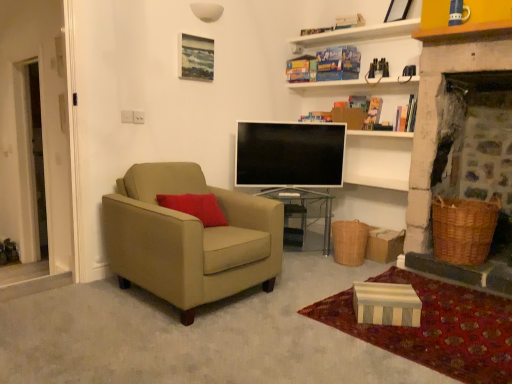
Question: Considering the relative sizes of suede beige armchair at left and striped cardboard box at lower right in the image provided, is suede beige armchair at left shorter than striped cardboard box at lower right?

Choices:
 (A) no
 (B) yes

Answer: (A)

Question: Is suede beige armchair at left oriented towards striped cardboard box at lower right?

Choices:
 (A) yes
 (B) no

Answer: (B)

Question: From a real-world perspective, is suede beige armchair at left beneath striped cardboard box at lower right?

Choices:
 (A) no
 (B) yes

Answer: (A)

Question: Is suede beige armchair at left oriented away from striped cardboard box at lower right?

Choices:
 (A) yes
 (B) no

Answer: (B)

Question: Is suede beige armchair at left not inside striped cardboard box at lower right?

Choices:
 (A) no
 (B) yes

Answer: (B)

Question: Does point (453, 216) appear closer or farther from the camera than point (459, 375)?

Choices:
 (A) farther
 (B) closer

Answer: (A)

Question: Considering the positions of woven brown picnic basket at lower right, acting as the 2th picnic basket starting from the left, and striped cardboard box at lower right in the image, is woven brown picnic basket at lower right, acting as the 2th picnic basket starting from the left, taller or shorter than striped cardboard box at lower right?

Choices:
 (A) short
 (B) tall

Answer: (B)

Question: Looking at their shapes, would you say woven brown picnic basket at lower right, which is counted as the 1th picnic basket, starting from the right, is wider or thinner than striped cardboard box at lower right?

Choices:
 (A) wide
 (B) thin

Answer: (B)

Question: From the image's perspective, is woven brown picnic basket at lower right, acting as the 2th picnic basket starting from the left, located above or below striped cardboard box at lower right?

Choices:
 (A) above
 (B) below

Answer: (A)

Question: In the image, is flat screen tv at center positioned in front of or behind woven brown picnic basket at lower center, which is the 2th picnic basket in right-to-left order?

Choices:
 (A) behind
 (B) front

Answer: (A)

Question: Is flat screen tv at center situated inside woven brown picnic basket at lower center, which is the 2th picnic basket in right-to-left order, or outside?

Choices:
 (A) outside
 (B) inside

Answer: (A)

Question: Looking at their shapes, would you say flat screen tv at center is wider or thinner than woven brown picnic basket at lower center, which is the 2th picnic basket in right-to-left order?

Choices:
 (A) wide
 (B) thin

Answer: (B)

Question: From the image's perspective, is flat screen tv at center located above or below woven brown picnic basket at lower center, which is the 2th picnic basket in right-to-left order?

Choices:
 (A) above
 (B) below

Answer: (A)

Question: Which is correct: suede beige armchair at left is inside woven brown picnic basket at lower right, acting as the 2th picnic basket starting from the left, or outside of it?

Choices:
 (A) inside
 (B) outside

Answer: (B)

Question: In the image, is suede beige armchair at left on the left side or the right side of woven brown picnic basket at lower right, acting as the 2th picnic basket starting from the left?

Choices:
 (A) left
 (B) right

Answer: (A)